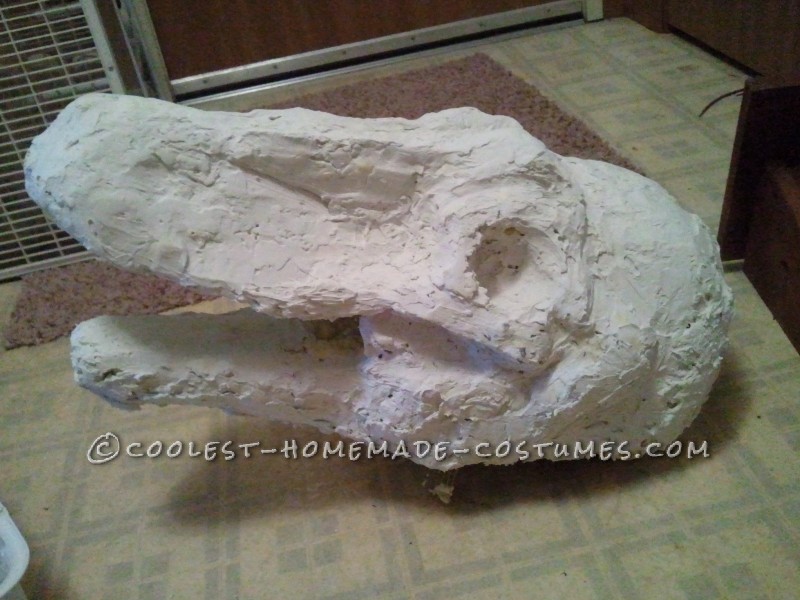
Locate an element on the screen. The height and width of the screenshot is (600, 800). metal doorjam is located at coordinates (389, 49).